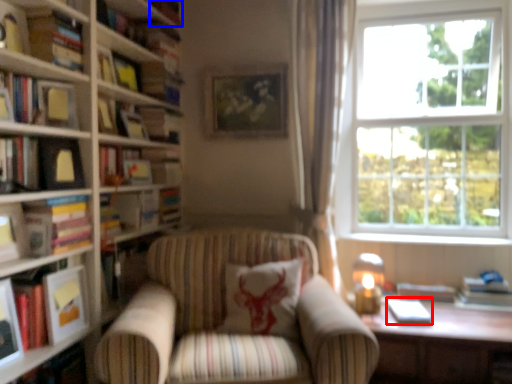
Question: Which point is further to the camera, paperback book (highlighted by a red box) or book (highlighted by a blue box)?

Choices:
 (A) paperback book
 (B) book

Answer: (B)